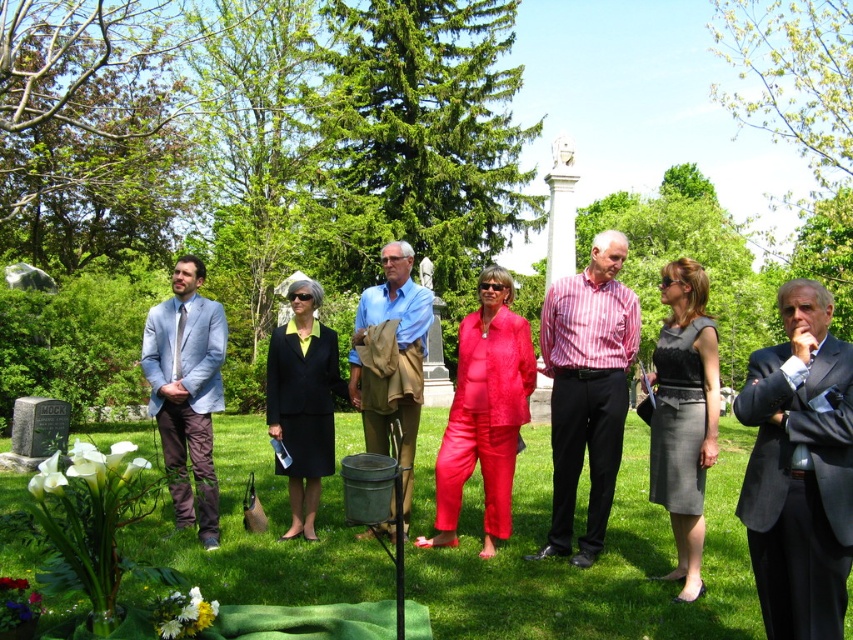
Consider the image. Is dark gray suit at center positioned behind striped cotton shirt at center?

No, it is in front of striped cotton shirt at center.

Which is in front, point (822, 484) or point (599, 525)?

Point (822, 484)

Between point (816, 509) and point (567, 392), which one is positioned in front?

Point (816, 509) is in front.

Locate an element on the screen. dark gray suit at center is located at coordinates tap(799, 468).

Who is positioned more to the right, gray satin dress at center or light blue textured suit at left?

gray satin dress at center

Measure the distance between gray satin dress at center and camera.

The distance of gray satin dress at center from camera is 9.72 meters.

This screenshot has height=640, width=853. Find the location of `gray satin dress at center`. gray satin dress at center is located at coordinates (683, 416).

Is dark gray suit at center below light blue textured suit at left?

Incorrect, dark gray suit at center is not positioned below light blue textured suit at left.

Who is positioned more to the left, dark gray suit at center or light blue textured suit at left?

Positioned to the left is light blue textured suit at left.

What are the coordinates of `dark gray suit at center` in the screenshot? It's located at (799, 468).